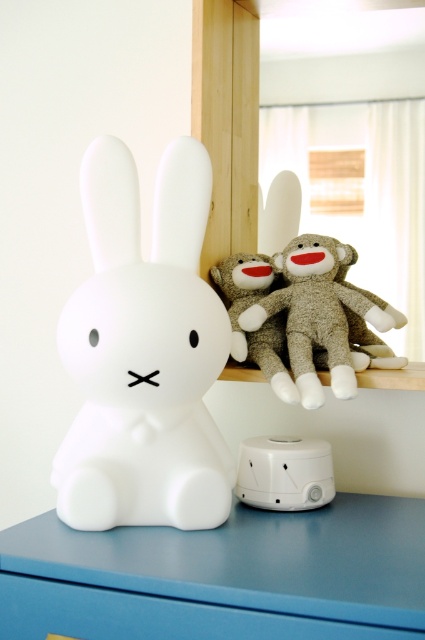
Question: Is white matte rabbit at center above white plastic humidifier at lower center?

Choices:
 (A) no
 (B) yes

Answer: (B)

Question: Which object is positioned farthest from the blue matte drawer at lower center?

Choices:
 (A) white plastic humidifier at lower center
 (B) matte white dresser at lower center

Answer: (A)

Question: Is white matte rabbit at center positioned behind soft plush fabric at center?

Choices:
 (A) yes
 (B) no

Answer: (B)

Question: Which point is closer to the camera taking this photo?

Choices:
 (A) coord(382,605)
 (B) coord(163,385)

Answer: (A)

Question: Can you confirm if blue matte drawer at lower center is positioned above soft plush fabric at center?

Choices:
 (A) yes
 (B) no

Answer: (B)

Question: Which point is closer to the camera?

Choices:
 (A) (343, 595)
 (B) (342, 636)
 (C) (322, 275)
 (D) (107, 144)

Answer: (B)